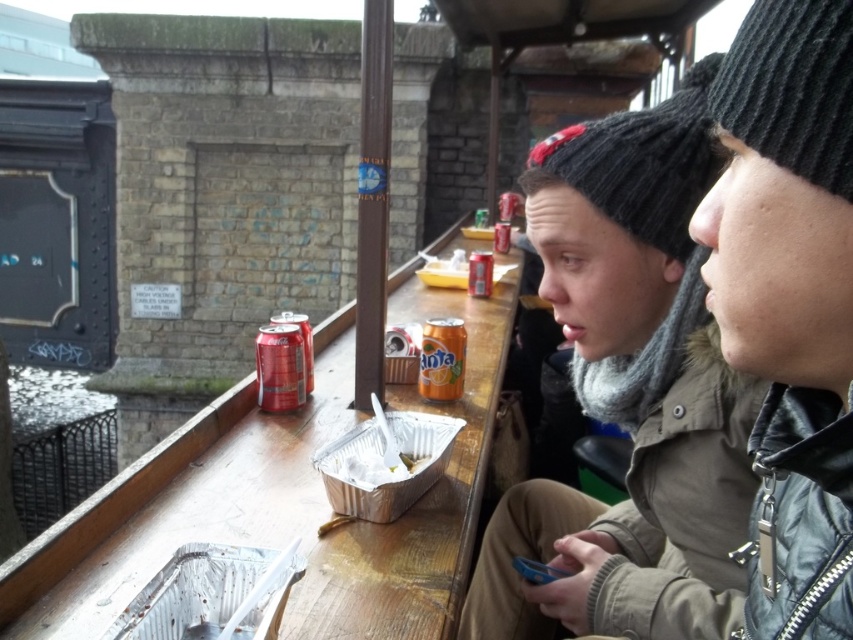
You are a customer at this outdoor seating area and need to place your phone between the knitted woolen hat at upper right and the orange matte can at center. Considering their sizes, which object should you place the phone closer to to ensure it fits comfortably?

Since the knitted woolen hat at upper right is larger than the orange matte can at center, you should place the phone closer to the orange matte can at center to ensure there is enough space.

You are a customer at the outdoor seating area and want to grab the orange matte can at center without moving the black knitted hat at center. Is this possible based on their positions?

The black knitted hat at center is positioned on the right side of the orange matte can at center, so you can reach the orange matte can at center by approaching from the left side of the hat.